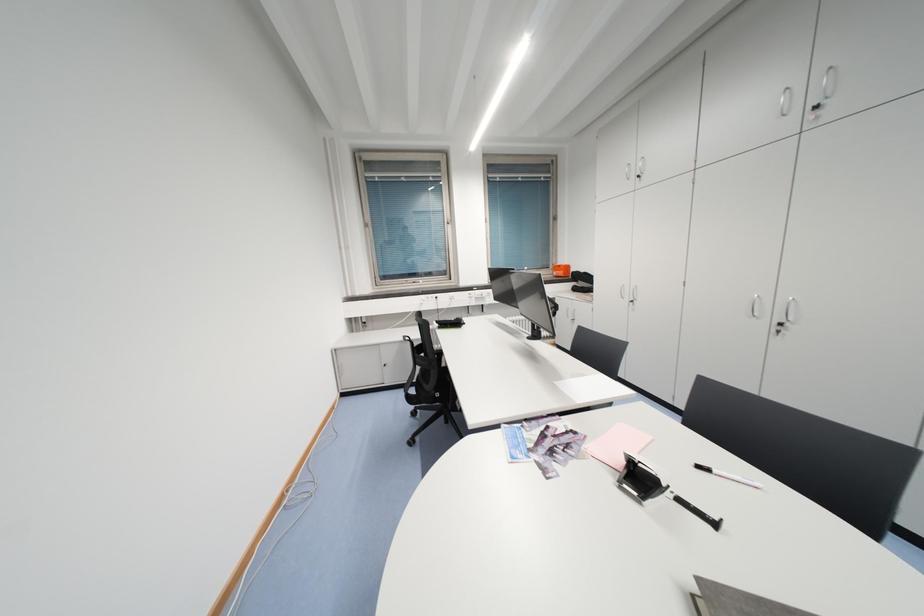
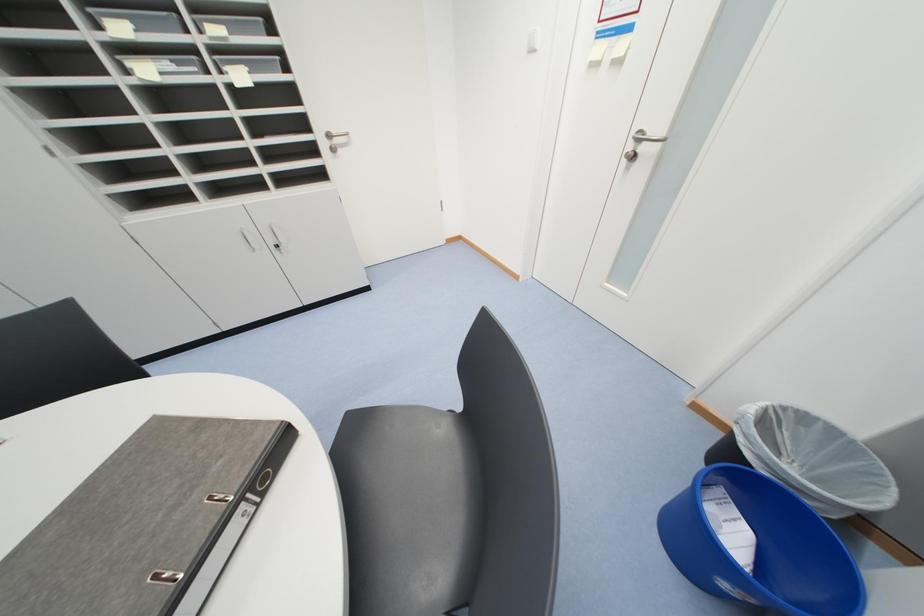
The first image is from the beginning of the video and the second image is from the end. How did the camera likely rotate when shooting the video?

The camera rotated toward right-down.